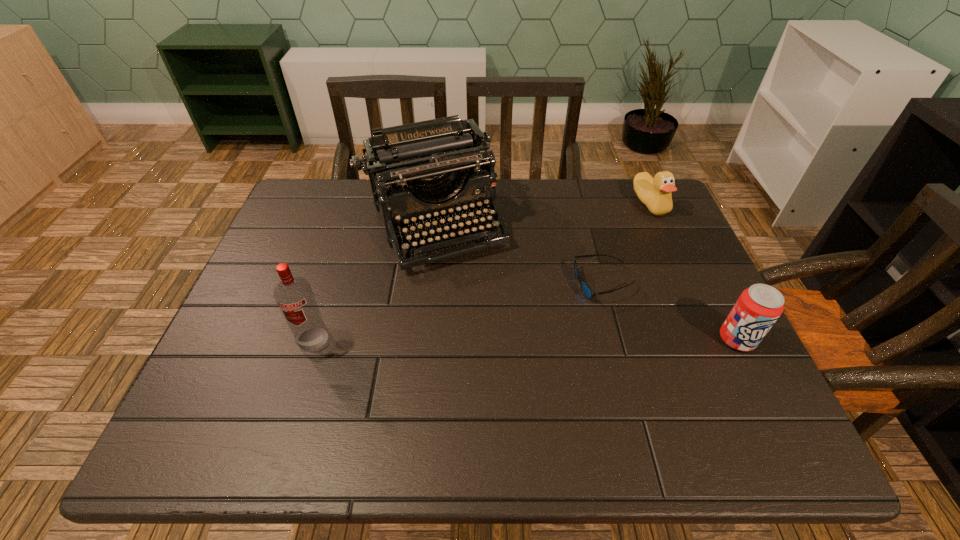
What are the coordinates of `vacant area located 0.060m on the typing side of the typewriter` in the screenshot? It's located at (467, 289).

Identify the location of vacant space positioned on the typing side of the typewriter. (496, 349).

Where is `vacant space located 0.170m on the typing side of the typewriter`? vacant space located 0.170m on the typing side of the typewriter is located at coordinates (483, 322).

Locate an element on the screen. The height and width of the screenshot is (540, 960). vacant space situated at the front of the shortest object showing the lenses is located at coordinates (509, 376).

The height and width of the screenshot is (540, 960). Identify the location of free location located at the front of the shortest object showing the lenses. (524, 361).

This screenshot has width=960, height=540. I want to click on free location located at the front of the shortest object showing the lenses, so click(x=575, y=311).

Where is `duck present at the far edge`? duck present at the far edge is located at coordinates (655, 193).

This screenshot has height=540, width=960. I want to click on typewriter that is at the far edge, so point(422,161).

The image size is (960, 540). I want to click on object that is at the left edge, so click(x=294, y=296).

Locate an element on the screen. This screenshot has height=540, width=960. soda can that is at the right edge is located at coordinates (758, 307).